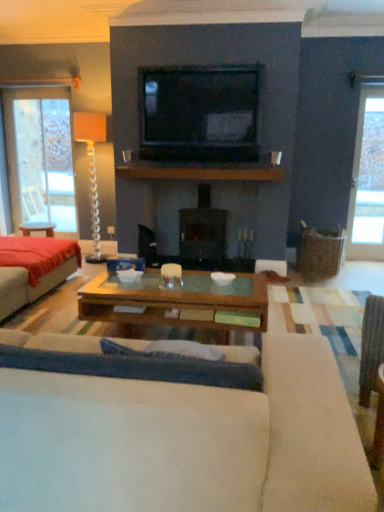
Identify the location of black glossy tv at upper center. (199, 113).

This screenshot has height=512, width=384. What do you see at coordinates (199, 113) in the screenshot?
I see `black glossy tv at upper center` at bounding box center [199, 113].

What is the approximate width of translucent glass floor lamp at left?

translucent glass floor lamp at left is 38.47 centimeters wide.

Measure the distance between clear glass window at left, the 2th window in the right-to-left sequence, and camera.

clear glass window at left, the 2th window in the right-to-left sequence, and camera are 5.67 meters apart.

You are a GUI agent. You are given a task and a screenshot of the screen. Output one action in this format:
    pyautogui.click(x=<x>, y=<y>)
    Task: Click on the dark gray stone fireplace at center
    This screenshot has width=384, height=512.
    Given the screenshot: What is the action you would take?
    pyautogui.click(x=202, y=233)

Find the location of `black glossy tv at upper center`. black glossy tv at upper center is located at coordinates (199, 113).

Where is `lamp lying above the red fabric bed at left (from the image's perspective)`? This screenshot has width=384, height=512. lamp lying above the red fabric bed at left (from the image's perspective) is located at coordinates (92, 169).

Can you see translucent glass floor lamp at left touching red fabric bed at left?

No.

Considering the relative sizes of translucent glass floor lamp at left and red fabric bed at left in the image provided, is translucent glass floor lamp at left shorter than red fabric bed at left?

Incorrect, the height of translucent glass floor lamp at left does not fall short of that of red fabric bed at left.

Relative to red fabric bed at left, is translucent glass floor lamp at left in front or behind?

translucent glass floor lamp at left is positioned farther from the viewer than red fabric bed at left.

In the scene shown: Can we say white fabric studio couch at center lies outside clear glass door at right, which is counted as the 2th window, starting from the back?

white fabric studio couch at center is positioned outside clear glass door at right, which is counted as the 2th window, starting from the back.

Does white fabric studio couch at center appear on the left side of clear glass door at right, which ranks as the first window in right-to-left order?

Yes, white fabric studio couch at center is to the left of clear glass door at right, which ranks as the first window in right-to-left order.

There is a white fabric studio couch at center. What are the coordinates of `the 1st window above it (from a real-world perspective)` in the screenshot? It's located at (367, 180).

Who is more distant, white fabric studio couch at center or clear glass door at right, the second window when ordered from left to right?

clear glass door at right, the second window when ordered from left to right, is more distant.

Is black glossy tv at upper center inside or outside of matte white coffee cup at center?

black glossy tv at upper center is outside matte white coffee cup at center.

From the picture: From a real-world perspective, relative to matte white coffee cup at center, is black glossy tv at upper center vertically above or below?

In terms of real-world spatial position, black glossy tv at upper center is above matte white coffee cup at center.

Is black glossy tv at upper center aimed at matte white coffee cup at center?

No, black glossy tv at upper center does not turn towards matte white coffee cup at center.

Based on the photo, are black glossy tv at upper center and matte white coffee cup at center far apart?

No, black glossy tv at upper center is not far from matte white coffee cup at center.

In the image, is clear glass door at right, the second window when ordered from left to right, on the left side or the right side of black glossy tv at upper center?

Based on their positions, clear glass door at right, the second window when ordered from left to right, is located to the right of black glossy tv at upper center.

Considering the relative sizes of clear glass door at right, arranged as the 1th window when viewed from the front, and black glossy tv at upper center in the image provided, is clear glass door at right, arranged as the 1th window when viewed from the front, wider than black glossy tv at upper center?

No, clear glass door at right, arranged as the 1th window when viewed from the front, is not wider than black glossy tv at upper center.

Which is in front, point (125, 161) or point (95, 185)?

Point (125, 161)

What's the angular difference between matte white coffee cup at center and translucent glass floor lamp at left's facing directions?

The facing directions of matte white coffee cup at center and translucent glass floor lamp at left are 1.15 degrees apart.

Is matte white coffee cup at center at the left side of translucent glass floor lamp at left?

No.

Between matte white coffee cup at center and translucent glass floor lamp at left, which one has larger width?

Wider between the two is translucent glass floor lamp at left.

From the image's perspective, between matte white coffee cup at center and black glossy tv at upper center, which one is located above?

black glossy tv at upper center.

Who is shorter, matte white coffee cup at center or black glossy tv at upper center?

With less height is matte white coffee cup at center.

Is matte white coffee cup at center facing towards black glossy tv at upper center?

No, matte white coffee cup at center is not oriented towards black glossy tv at upper center.

Is matte white coffee cup at center positioned in front of black glossy tv at upper center?

No, matte white coffee cup at center is further to the viewer.

Considering the relative positions of clear glass door at right, the second window when ordered from left to right, and clear glass window at left, the 2th window in the right-to-left sequence, in the image provided, is clear glass door at right, the second window when ordered from left to right, to the right of clear glass window at left, the 2th window in the right-to-left sequence, from the viewer's perspective?

Correct, you'll find clear glass door at right, the second window when ordered from left to right, to the right of clear glass window at left, the 2th window in the right-to-left sequence.

Is clear glass door at right, which is counted as the 2th window, starting from the back, looking in the opposite direction of clear glass window at left, arranged as the second window when viewed from the front?

No, clear glass window at left, arranged as the second window when viewed from the front, is not at the back of clear glass door at right, which is counted as the 2th window, starting from the back.

Looking at this image, from a real-world perspective, does clear glass door at right, which ranks as the first window in right-to-left order, sit lower than clear glass window at left, arranged as the second window when viewed from the front?

Yes, from a real-world perspective, clear glass door at right, which ranks as the first window in right-to-left order, is under clear glass window at left, arranged as the second window when viewed from the front.

Where is `bed that is under the translucent glass floor lamp at left (from a real-world perspective)`? The image size is (384, 512). bed that is under the translucent glass floor lamp at left (from a real-world perspective) is located at coordinates (34, 271).

Identify the location of studio couch that is on the left side of clear glass door at right, which is counted as the 2th window, starting from the back. (x=186, y=441).

Looking at the image, which one is located further to black glossy tv at upper center, matte white coffee cup at center or white fabric studio couch at center?

Among the two, white fabric studio couch at center is located further to black glossy tv at upper center.

Which object lies further to the anchor point clear glass window at left, which ranks as the 1th window in back-to-front order, white fabric studio couch at center or black glossy tv at upper center?

white fabric studio couch at center lies further to clear glass window at left, which ranks as the 1th window in back-to-front order, than the other object.

From the image, which object appears to be nearer to white fabric studio couch at center, translucent glass floor lamp at left or clear glass door at right, which is counted as the 2th window, starting from the back?

clear glass door at right, which is counted as the 2th window, starting from the back, is closer to white fabric studio couch at center.

When comparing their distances from clear glass window at left, the 2th window in the right-to-left sequence, does red fabric bed at left or matte white coffee cup at center seem closer?

matte white coffee cup at center lies closer to clear glass window at left, the 2th window in the right-to-left sequence, than the other object.

Looking at the image, which one is located closer to matte white coffee cup at center, white fabric studio couch at center or clear glass door at right, the second window when ordered from left to right?

Among the two, clear glass door at right, the second window when ordered from left to right, is located nearer to matte white coffee cup at center.

Considering their positions, is black glossy tv at upper center positioned closer to red fabric bed at left than translucent glass floor lamp at left?

The object closer to red fabric bed at left is black glossy tv at upper center.

Which object lies further to the anchor point translucent glass floor lamp at left, red fabric bed at left or brown wooden mantle at center?

The object further to translucent glass floor lamp at left is red fabric bed at left.

Considering their positions, is translucent glass floor lamp at left positioned closer to dark gray stone fireplace at center than brown wooden mantle at center?

brown wooden mantle at center.

You are a GUI agent. You are given a task and a screenshot of the screen. Output one action in this format:
    pyautogui.click(x=<x>, y=<y>)
    Task: Click on the mantle between matte white coffee cup at center and black glossy tv at upper center from left to right
    Image resolution: width=384 pixels, height=512 pixels.
    Given the screenshot: What is the action you would take?
    pyautogui.click(x=201, y=170)

I want to click on mantle between matte white coffee cup at center and dark gray stone fireplace at center in the horizontal direction, so click(201, 170).

At what (x,y) coordinates should I click in order to perform the action: click on mantle between white fabric studio couch at center and matte white coffee cup at center from front to back. Please return your answer as a coordinate pair (x, y). Image resolution: width=384 pixels, height=512 pixels. Looking at the image, I should click on (201, 170).

Where is `lamp situated between red fabric bed at left and black glossy tv at upper center from left to right`? lamp situated between red fabric bed at left and black glossy tv at upper center from left to right is located at coordinates (92, 169).